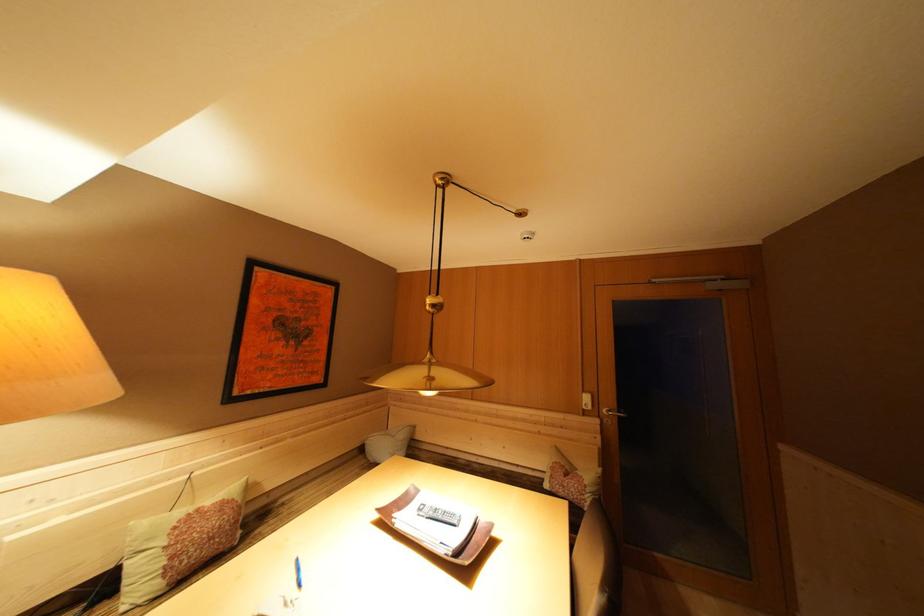
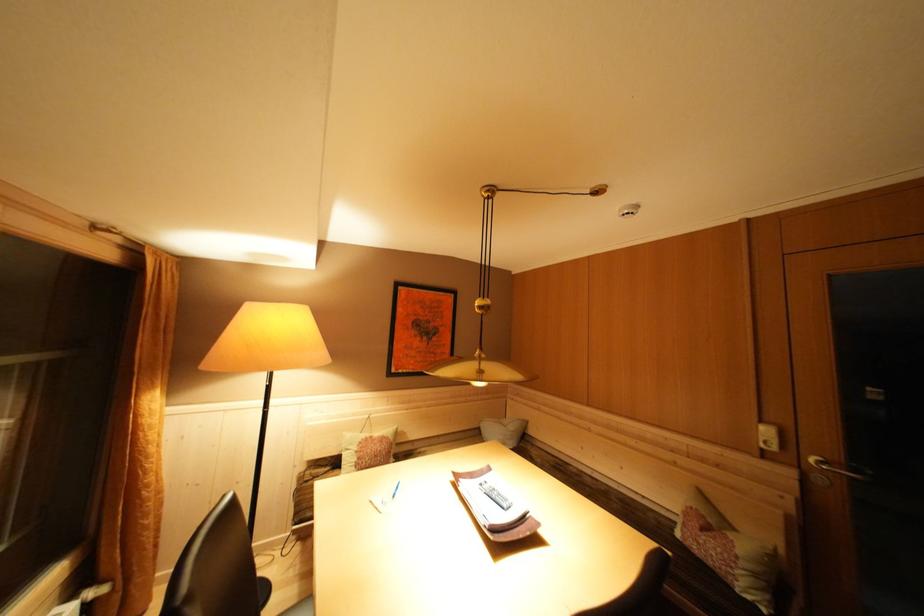
Where in the second image is the point corresponding to the point at 427,515 from the first image?

(488, 488)